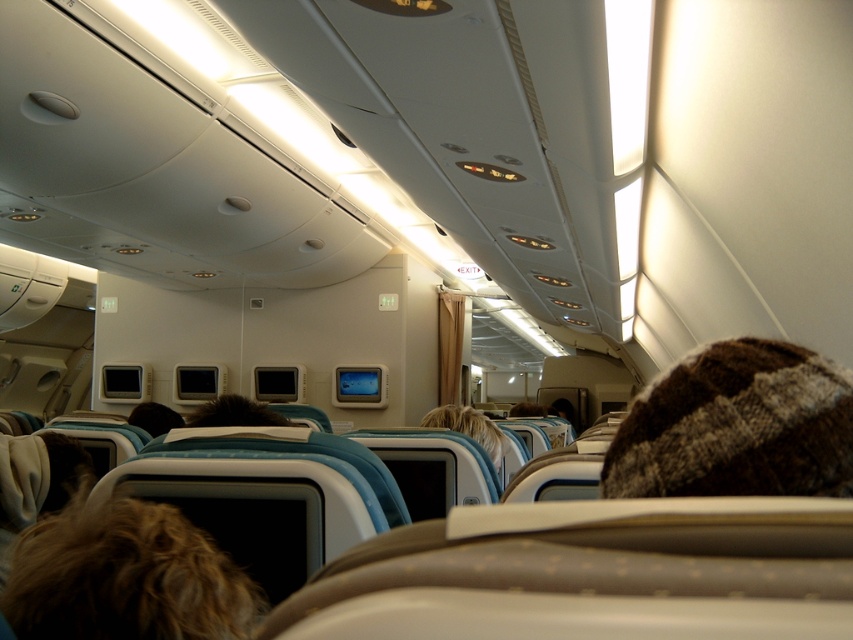
Question: Which object is positioned closest to the blonde hair at center?

Choices:
 (A) brown fuzzy hair at lower left
 (B) brown knitted hat at upper right

Answer: (A)

Question: Which of the following is the farthest from the observer?

Choices:
 (A) (799, 410)
 (B) (160, 556)

Answer: (B)

Question: Where is brown knitted hat at upper right located in relation to brown fuzzy hair at lower left in the image?

Choices:
 (A) right
 (B) left

Answer: (A)

Question: Can you confirm if brown knitted hat at upper right is positioned to the right of blonde hair at center?

Choices:
 (A) yes
 (B) no

Answer: (A)

Question: Does brown knitted hat at upper right have a larger size compared to blonde hair at center?

Choices:
 (A) no
 (B) yes

Answer: (A)

Question: Which object is farther from the camera taking this photo?

Choices:
 (A) brown knitted hat at upper right
 (B) brown fuzzy hair at lower left
 (C) blonde hair at center

Answer: (C)